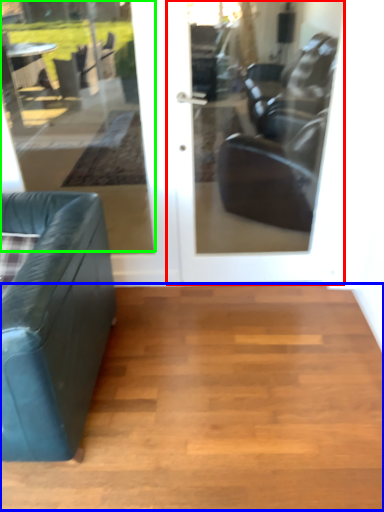
Question: Which object is positioned closest to door (highlighted by a red box)? Select from hardwood (highlighted by a blue box) and window (highlighted by a green box).

Choices:
 (A) hardwood
 (B) window

Answer: (A)